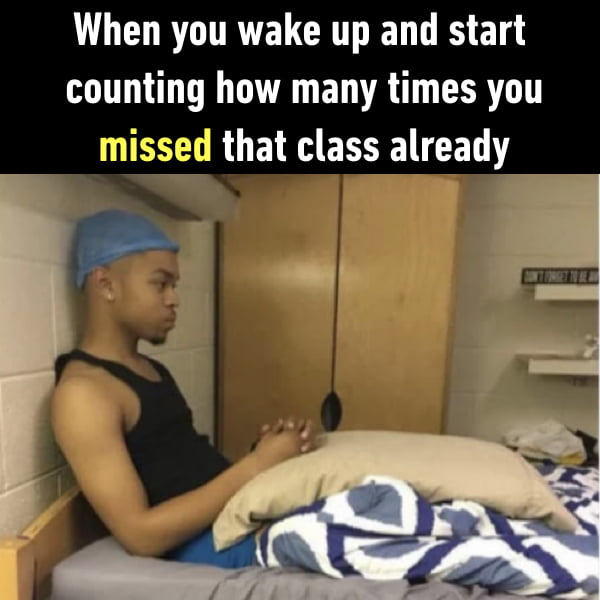
Find the location of a particular element. This screenshot has height=600, width=600. wood bed frame is located at coordinates tap(70, 540).